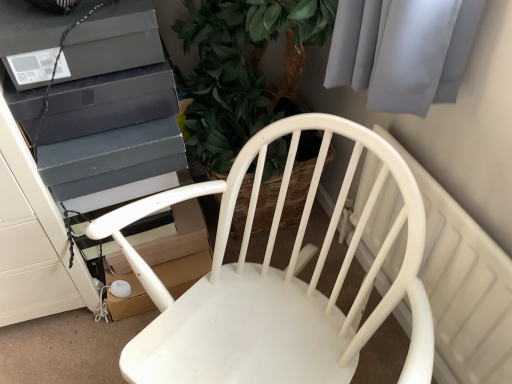
Question: Is matte black box at upper left, which is counted as the 2th appliance, starting from the top, surrounding white matte chair at center?

Choices:
 (A) no
 (B) yes

Answer: (A)

Question: Can you confirm if matte black box at upper left, which is counted as the first appliance, starting from the bottom, is smaller than white matte chair at center?

Choices:
 (A) no
 (B) yes

Answer: (B)

Question: From a real-world perspective, is matte black box at upper left, which is counted as the 2th appliance, starting from the top, on white matte chair at center?

Choices:
 (A) yes
 (B) no

Answer: (A)

Question: Can you confirm if matte black box at upper left, which is counted as the first appliance, starting from the bottom, is positioned to the right of white matte chair at center?

Choices:
 (A) no
 (B) yes

Answer: (A)

Question: Does matte black box at upper left, which is counted as the first appliance, starting from the bottom, have a greater height compared to white matte chair at center?

Choices:
 (A) no
 (B) yes

Answer: (A)

Question: Is white plastic radiator at upper right not close to matte black box at upper left, which is counted as the 2th appliance, starting from the top?

Choices:
 (A) yes
 (B) no

Answer: (B)

Question: From the image's perspective, is white plastic radiator at upper right below matte black box at upper left, which is counted as the first appliance, starting from the bottom?

Choices:
 (A) yes
 (B) no

Answer: (A)

Question: Is white plastic radiator at upper right aimed at matte black box at upper left, which is counted as the 2th appliance, starting from the top?

Choices:
 (A) no
 (B) yes

Answer: (B)

Question: From a real-world perspective, is white plastic radiator at upper right below matte black box at upper left, which is counted as the 2th appliance, starting from the top?

Choices:
 (A) no
 (B) yes

Answer: (B)

Question: Is white plastic radiator at upper right in contact with matte black box at upper left, which is counted as the first appliance, starting from the bottom?

Choices:
 (A) no
 (B) yes

Answer: (A)

Question: Is white plastic radiator at upper right not inside matte black box at upper left, which is counted as the 2th appliance, starting from the top?

Choices:
 (A) no
 (B) yes

Answer: (B)

Question: Is matte black box at upper left, which is counted as the 2th appliance, starting from the top, facing towards white plastic radiator at upper right?

Choices:
 (A) yes
 (B) no

Answer: (B)